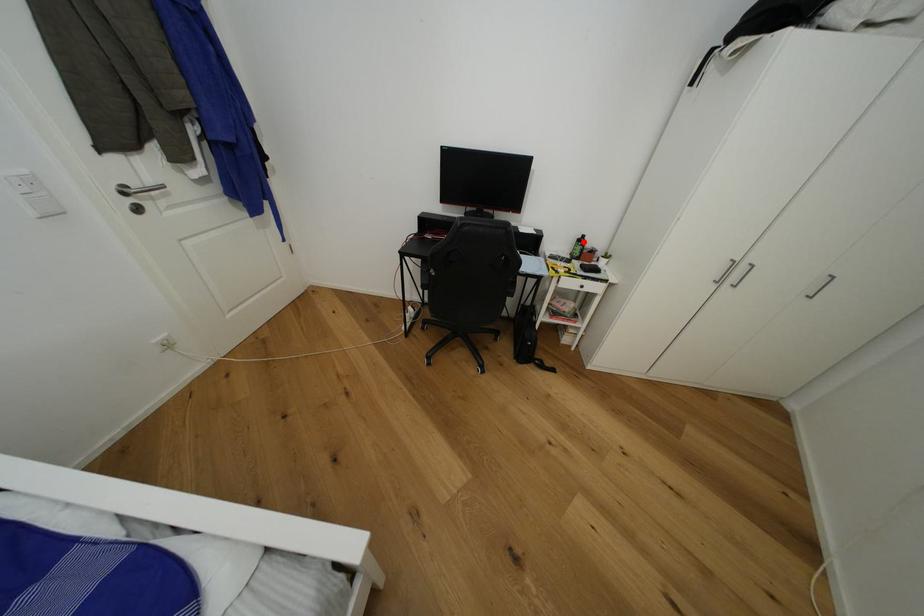
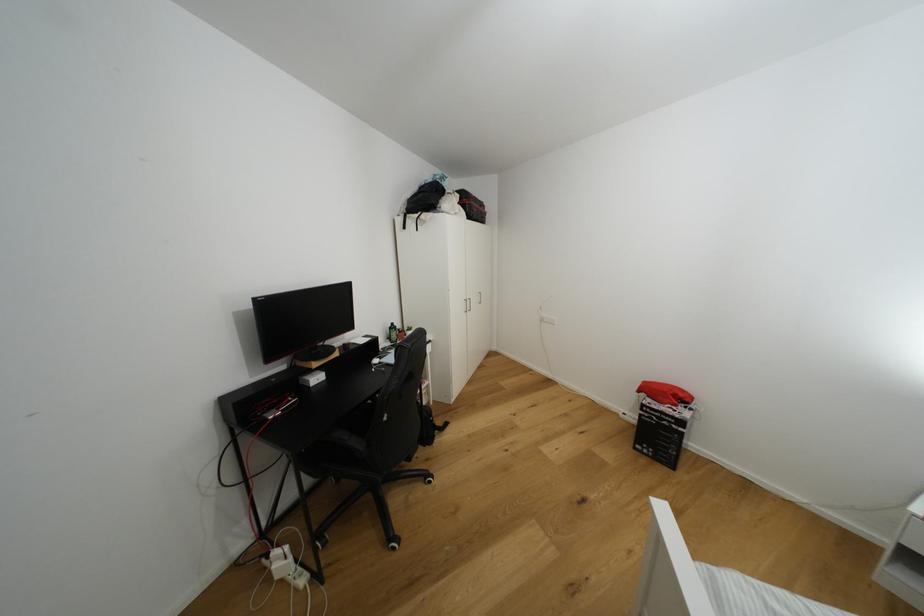
Question: A red point is marked in image1. In image2, is the corresponding 3D point closer to the camera or farther? Reply with the corresponding letter.

Choices:
 (A) The corresponding 3D point is closer.
 (B) The corresponding 3D point is farther.

Answer: (B)